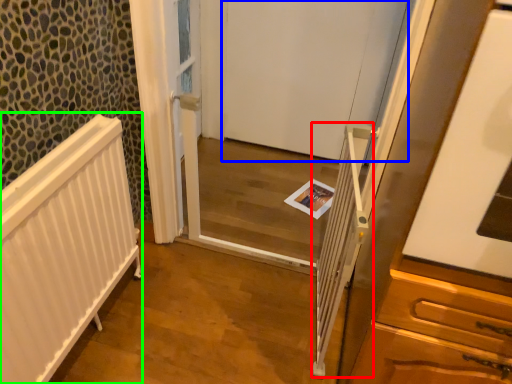
Question: Considering the real-world distances, which object is farthest from balustrade (highlighted by a red box)? door (highlighted by a blue box) or radiator (highlighted by a green box)?

Choices:
 (A) door
 (B) radiator

Answer: (A)